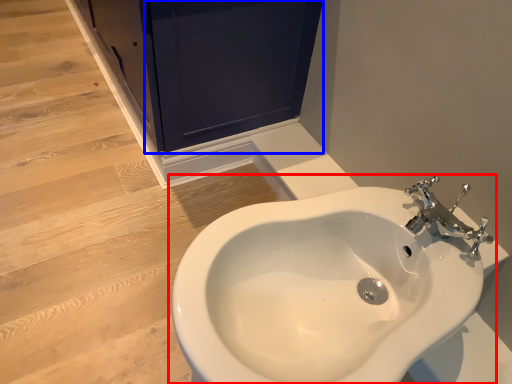
Question: Among these objects, which one is nearest to the camera, sink (highlighted by a red box) or screen door (highlighted by a blue box)?

Choices:
 (A) sink
 (B) screen door

Answer: (A)